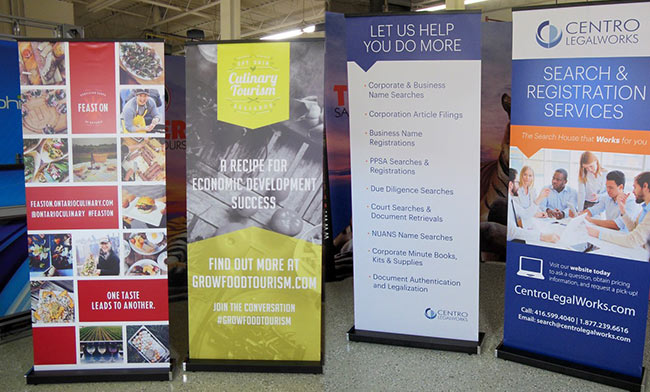
Where is `black stands`? The height and width of the screenshot is (392, 650). black stands is located at coordinates (127, 372), (246, 366), (411, 337), (543, 360).